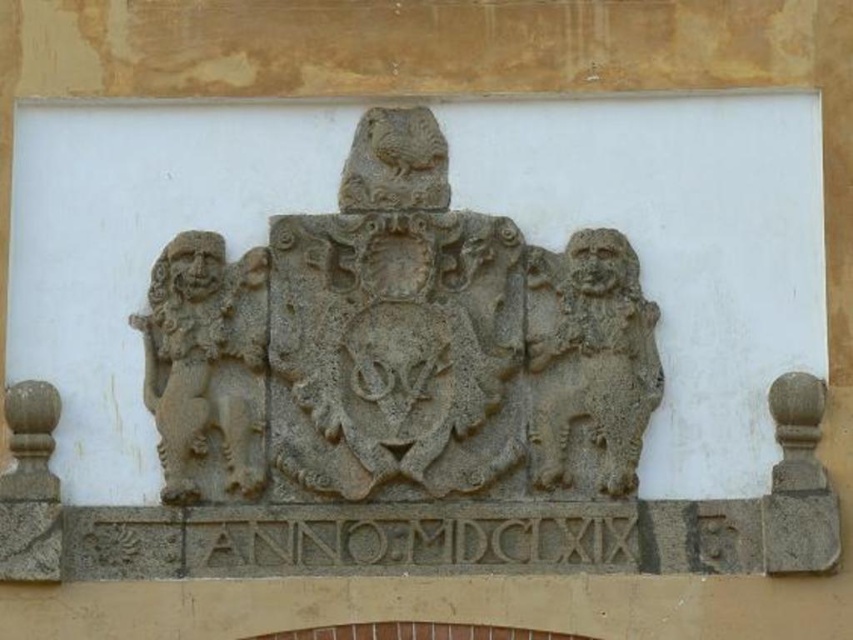
From the picture: Is gray stone coat of arms at center smaller than gray stone lion at right?

Incorrect, gray stone coat of arms at center is not smaller in size than gray stone lion at right.

Who is more forward, [299,291] or [601,442]?

Point [601,442]

The image size is (853, 640). Identify the location of gray stone coat of arms at center. (397, 348).

What are the coordinates of `gray stone coat of arms at center` in the screenshot? It's located at (397, 348).

Is point (463, 403) behind point (265, 342)?

No, it is not.

At what (x,y) coordinates should I click in order to perform the action: click on gray stone coat of arms at center. Please return your answer as a coordinate pair (x, y). Looking at the image, I should click on 397,348.

Does gray stone lion at left come behind gray stone lion at right?

No, gray stone lion at left is closer to the viewer.

In the scene shown: Is gray stone lion at left shorter than gray stone lion at right?

Yes.

From the picture: Measure the distance between gray stone lion at left and camera.

gray stone lion at left and camera are 70.83 meters apart from each other.

Find the location of `gray stone lion at left`. gray stone lion at left is located at coordinates (206, 362).